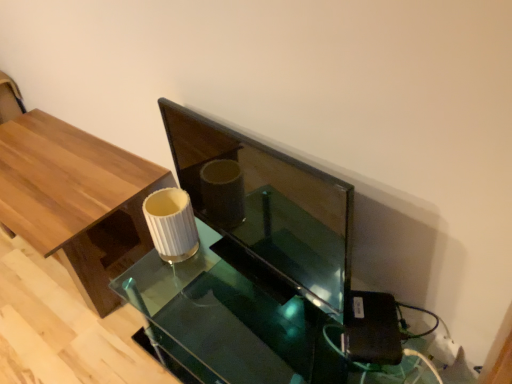
Question: Which is correct: translucent glass table at center is inside wooden table at left, or outside of it?

Choices:
 (A) outside
 (B) inside

Answer: (A)

Question: Is translucent glass table at center bigger or smaller than wooden table at left?

Choices:
 (A) big
 (B) small

Answer: (B)

Question: Relative to wooden table at left, is translucent glass table at center in front or behind?

Choices:
 (A) behind
 (B) front

Answer: (B)

Question: Considering the positions of wooden table at left and translucent glass table at center in the image, is wooden table at left bigger or smaller than translucent glass table at center?

Choices:
 (A) small
 (B) big

Answer: (B)

Question: From a real-world perspective, is wooden table at left above or below translucent glass table at center?

Choices:
 (A) below
 (B) above

Answer: (B)

Question: Do you think wooden table at left is within translucent glass table at center, or outside of it?

Choices:
 (A) inside
 (B) outside

Answer: (B)

Question: Based on their positions, is wooden table at left located to the left or right of translucent glass table at center?

Choices:
 (A) left
 (B) right

Answer: (A)